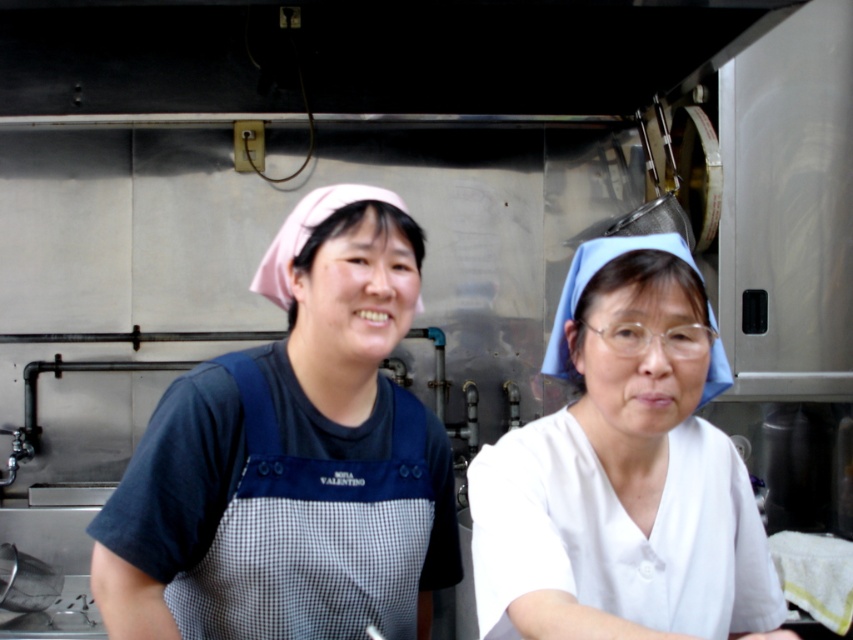
Is point (672, 528) positioned after point (154, 432)?

No, (672, 528) is closer to viewer.

Image resolution: width=853 pixels, height=640 pixels. I want to click on white fabric at center, so click(x=624, y=472).